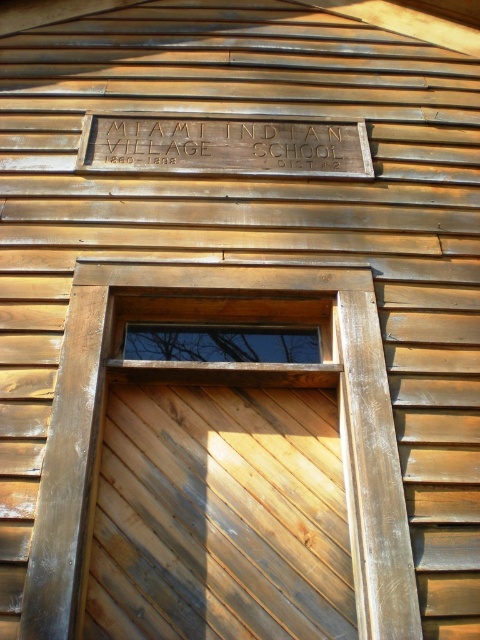
Question: Which of the following is the closest to the observer?

Choices:
 (A) (362, 637)
 (B) (310, 360)
 (C) (162, 161)

Answer: (A)

Question: Can you confirm if wooden frame window at center is wider than transparent glass window at center?

Choices:
 (A) yes
 (B) no

Answer: (A)

Question: In this image, where is wooden frame window at center located relative to transparent glass window at center?

Choices:
 (A) left
 (B) right

Answer: (B)

Question: Which of the following is the closest to the observer?

Choices:
 (A) wooden sign at center
 (B) wooden frame window at center

Answer: (B)

Question: Does wooden frame window at center have a smaller size compared to transparent glass window at center?

Choices:
 (A) no
 (B) yes

Answer: (A)

Question: Based on their relative distances, which object is nearer to the wooden frame window at center?

Choices:
 (A) wooden sign at center
 (B) transparent glass window at center

Answer: (B)